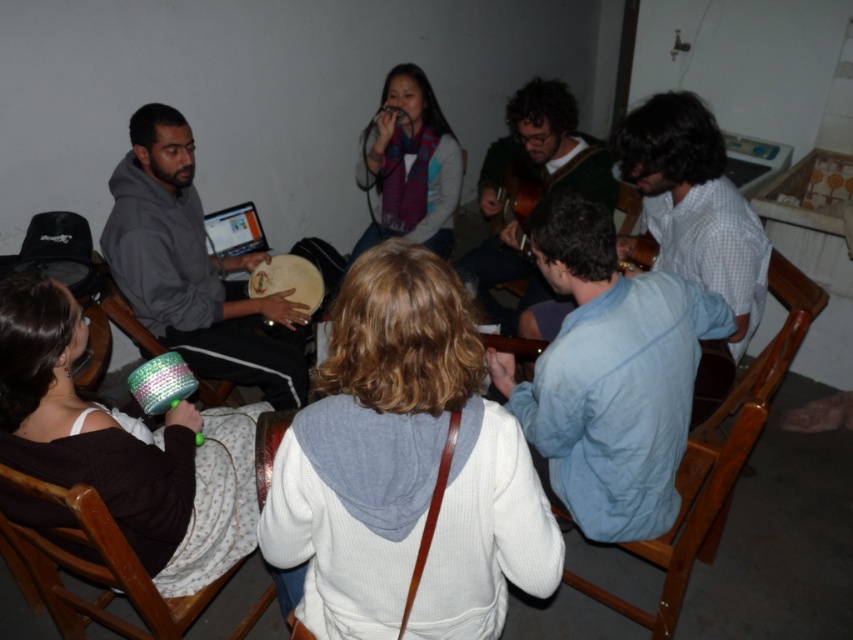
In the image, there are several people in a room. One person is sitting at point (410, 164) holding a tambourine, and another person is wearing a knitted scarf at center. Can you tell me which object is closer to the center of the image?

The knitted scarf at center is exactly at the center of the image, so it is closer to the center than the person at point (410, 164).

You are standing at the entrance of the room and want to locate the knitted scarf at center. According to the coordinates provided, in which direction should you look to find it?

The knitted scarf at center is located at coordinates point (410, 164), which means it is positioned slightly to the left and halfway up the image from the bottom. You should look towards the left side and middle area of the room to find it.

From the picture: You are standing in the room and want to hand a gift to the person wearing the white soft sweater at center without disturbing the wooden drum at center. Which object should you approach first?

The white soft sweater at center is closer to the viewer than the wooden drum at center, so you should approach the white soft sweater at center first to hand the gift without disturbing the drum.